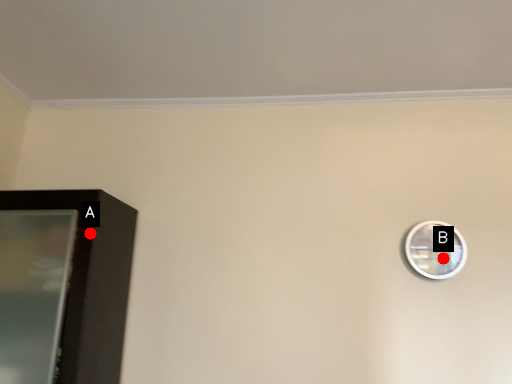
Question: Two points are circled on the image, labeled by A and B beside each circle. Which of the following is the closest to the observer?

Choices:
 (A) A is closer
 (B) B is closer

Answer: (A)